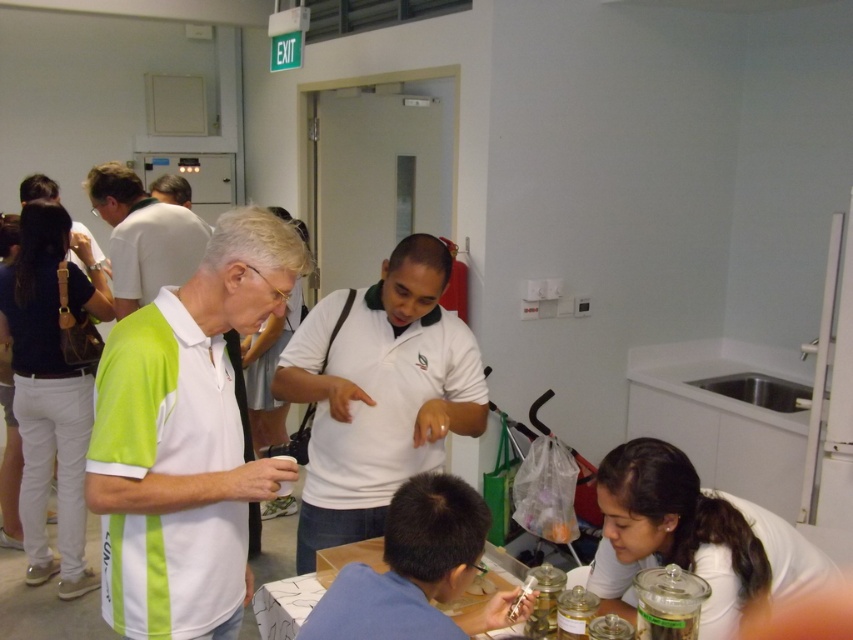
Between white matte shirt at center and white glossy table at lower center, which one has more height?

white matte shirt at center is taller.

Is point (335, 445) positioned before point (331, 566)?

No, it is behind (331, 566).

The image size is (853, 640). Find the location of `white matte shirt at center`. white matte shirt at center is located at coordinates (379, 394).

Find the location of a particular element. white matte polo shirt at center is located at coordinates (186, 440).

Identify the location of white matte polo shirt at center. Image resolution: width=853 pixels, height=640 pixels. (186, 440).

Between blue fabric shirt at lower center and white glossy table at lower center, which one appears on the left side from the viewer's perspective?

white glossy table at lower center

Which of these two, blue fabric shirt at lower center or white glossy table at lower center, stands shorter?

Standing shorter between the two is white glossy table at lower center.

Does point (392, 508) come closer to viewer compared to point (372, 566)?

Yes, it is in front of point (372, 566).

At what (x,y) coordinates should I click in order to perform the action: click on blue fabric shirt at lower center. Please return your answer as a coordinate pair (x, y). This screenshot has height=640, width=853. Looking at the image, I should click on (416, 572).